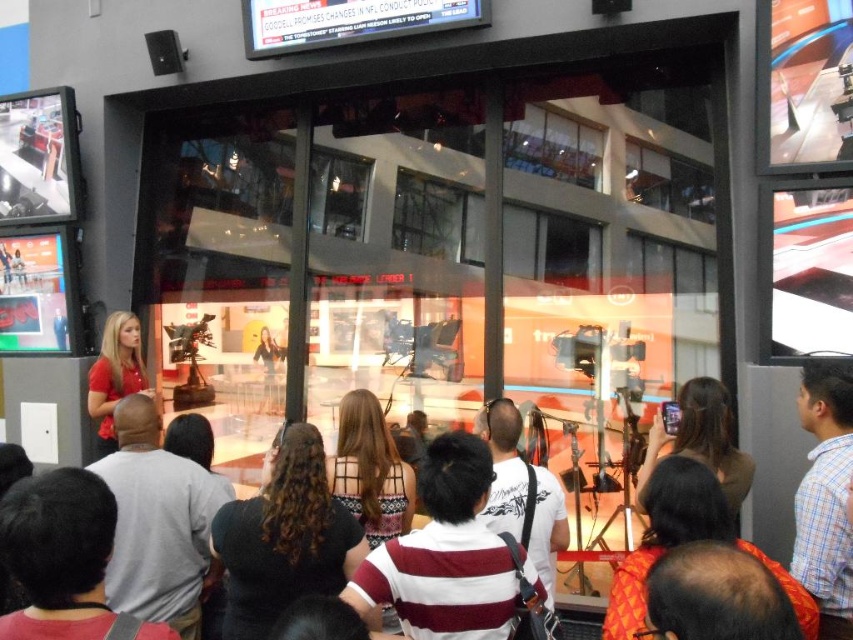
Question: Does black fabric at center appear on the left side of brown leather jacket at center?

Choices:
 (A) yes
 (B) no

Answer: (A)

Question: Is blue plaid shirt at right below matte red shirt at center?

Choices:
 (A) yes
 (B) no

Answer: (A)

Question: Considering the real-world distances, which object is farthest from the brown leather jacket at center?

Choices:
 (A) blue plaid shirt at right
 (B) black fabric at center

Answer: (B)

Question: Which point is farther from the camera taking this photo?

Choices:
 (A) (850, 412)
 (B) (550, 540)
 (C) (483, 634)
 (D) (108, 356)

Answer: (D)

Question: Among these points, which one is farthest from the camera?

Choices:
 (A) (97, 456)
 (B) (328, 522)
 (C) (403, 580)

Answer: (A)

Question: Is black fabric at center wider than white striped shirt at center?

Choices:
 (A) yes
 (B) no

Answer: (A)